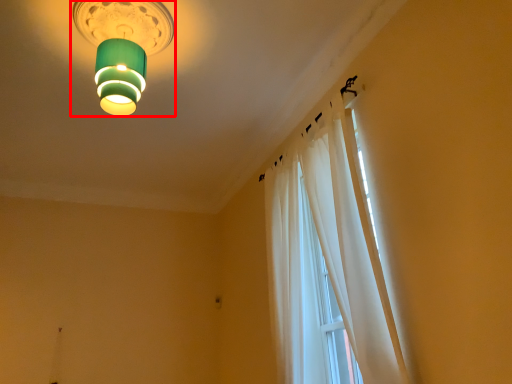
Question: From the image's perspective, where is lamp (annotated by the red box) located in relation to curtain in the image?

Choices:
 (A) above
 (B) below

Answer: (A)